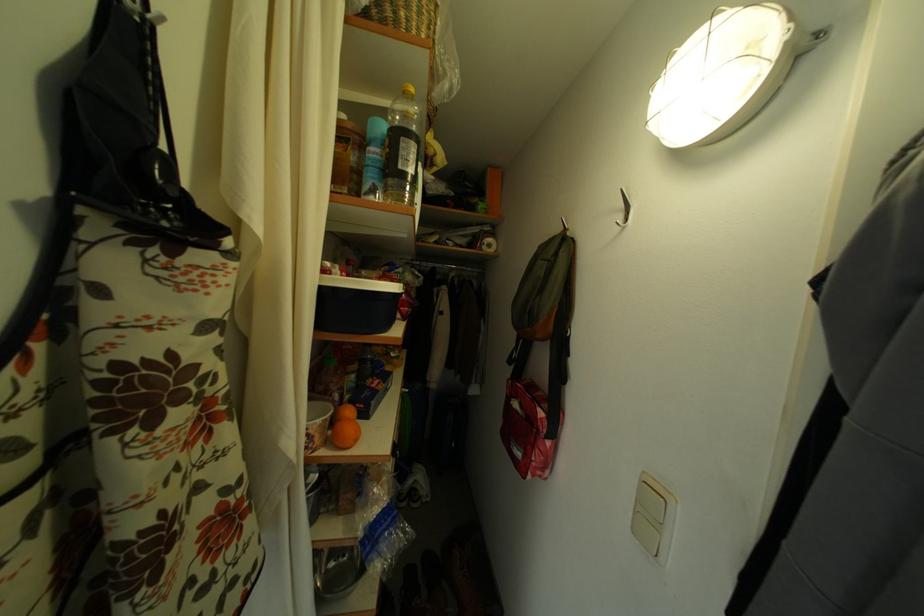
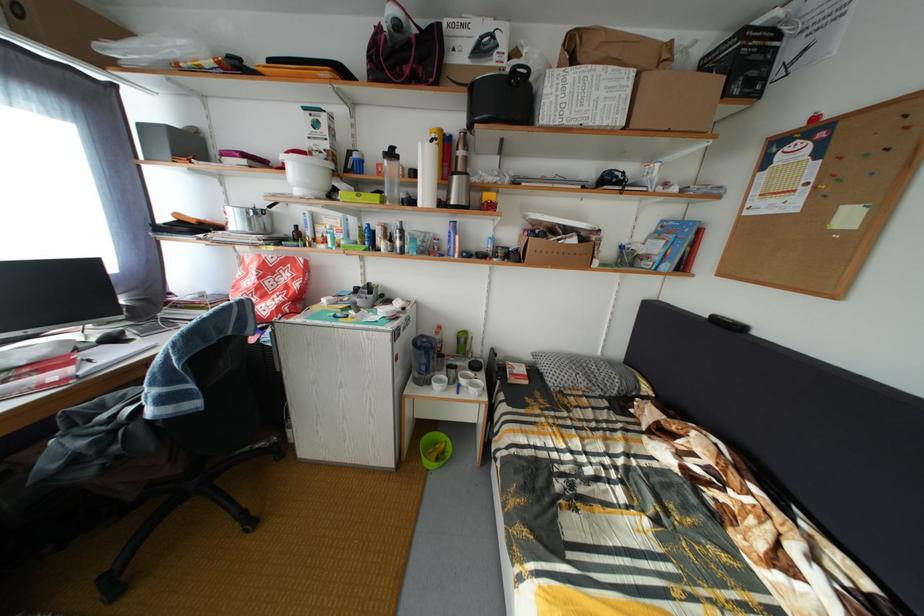
Question: The images are taken continuously from a first-person perspective. In which direction are you moving?

Choices:
 (A) Left
 (B) Right
 (C) Forward
 (D) Backward

Answer: (A)